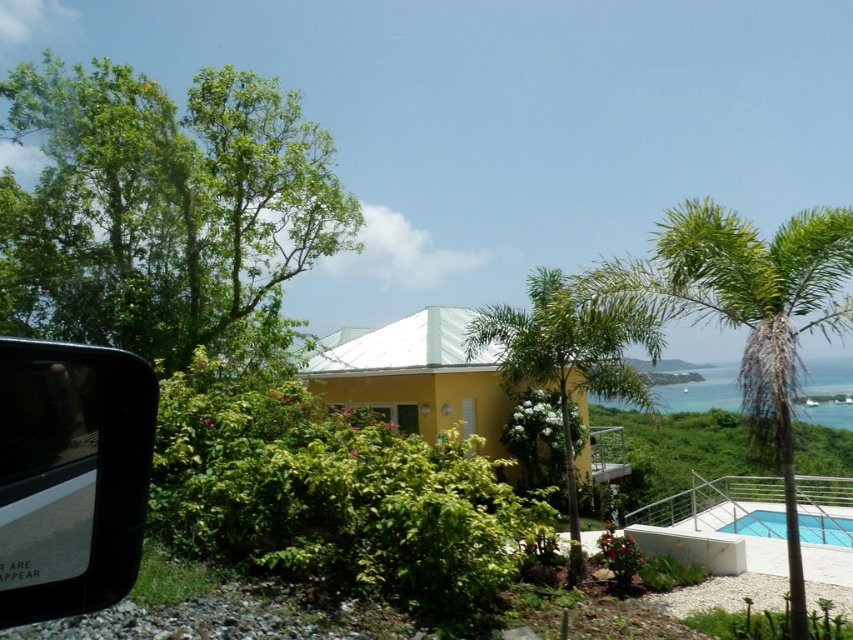
You are standing at the center of the white deck in front of the house. You want to take a photo of the green leafy tree at upper left marked by point (165,208). Which direction should you face to capture it in your view?

To capture the green leafy tree at upper left marked by point (165,208), you should face towards the upper left direction from your position at the center of the white deck.

You are a visitor at this tropical house and want to take a photo of both the green leafy palm tree at upper right and the transparent glass pool at lower right. Which object should you position closer to the right side of your camera frame to include both in the shot?

You should position the transparent glass pool at lower right closer to the right side of your camera frame because the green leafy palm tree at upper right is on its right side.

You are standing in the tropical setting shown in the image. You notice a point marked at coordinates [750,314]. What object does this point correspond to?

The point at coordinates [750,314] corresponds to the green leafy palm tree at upper right.